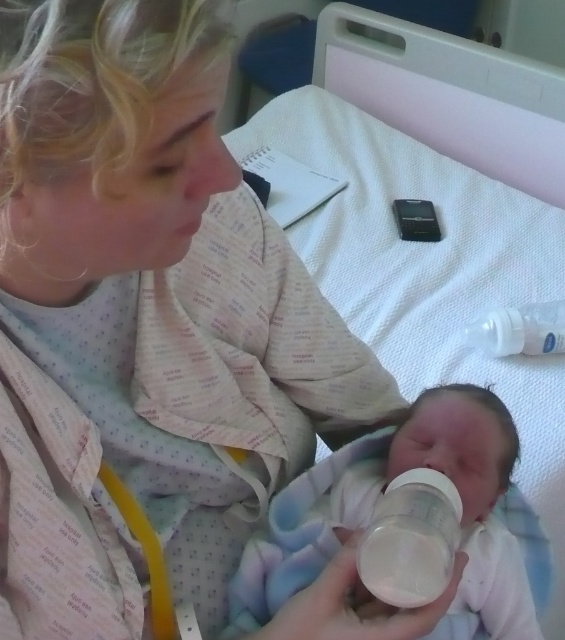
You are a nurse in the hospital and need to choose the taller bottle between the transparent plastic bottle at center and the white matte baby bottle at center. Which one should you select?

The transparent plastic bottle at center is taller than the white matte baby bottle at center, so you should select the transparent plastic bottle at center.

You are a nurse preparing to sterilize the white matte baby bottle at center and the transparent plastic bottle at upper right. Which bottle requires more space in the sterilizer?

The transparent plastic bottle at upper right requires more space in the sterilizer because it occupies more space than the white matte baby bottle at center.